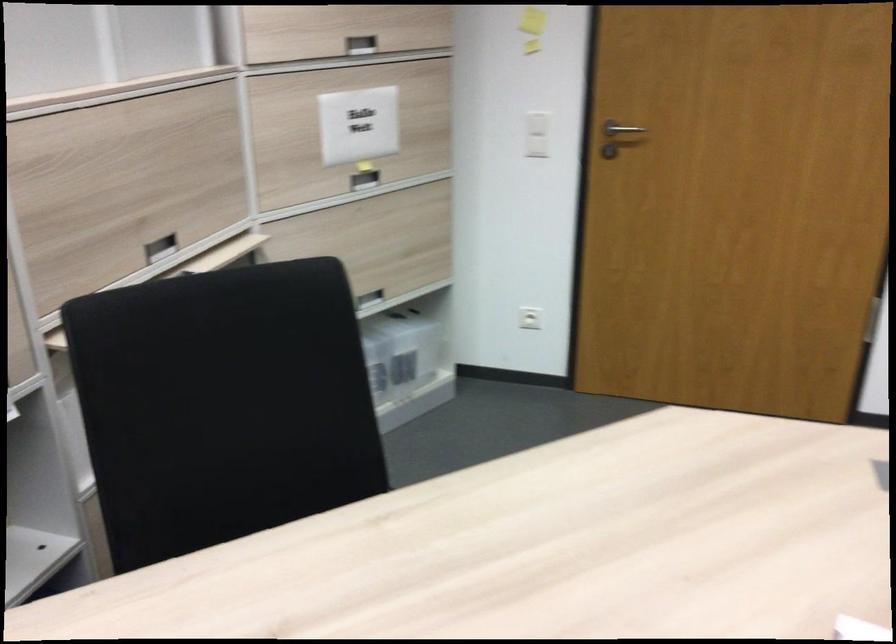
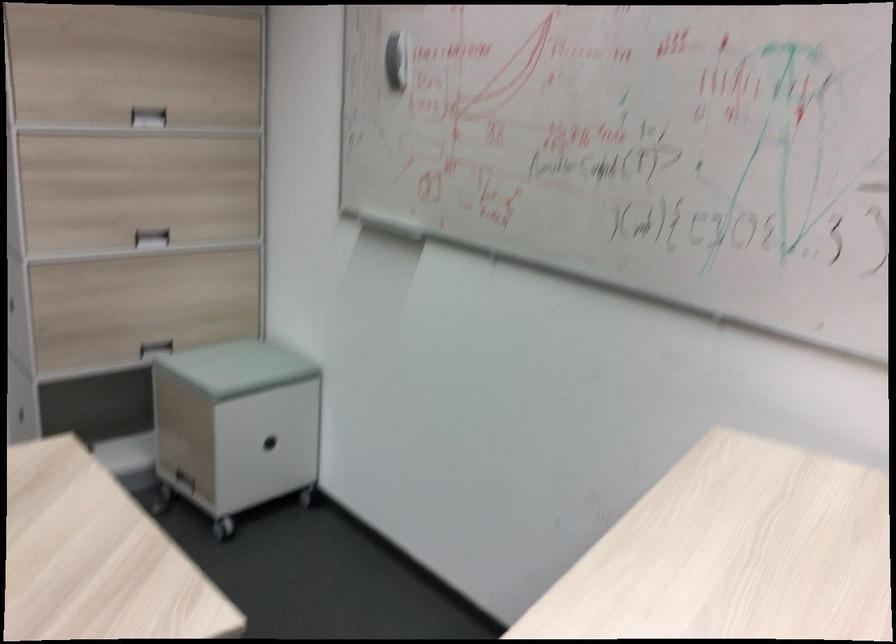
Question: The first image is from the beginning of the video and the second image is from the end. How did the camera likely rotate when shooting the video?

Choices:
 (A) Left
 (B) Right
 (C) Up
 (D) Down

Answer: (B)